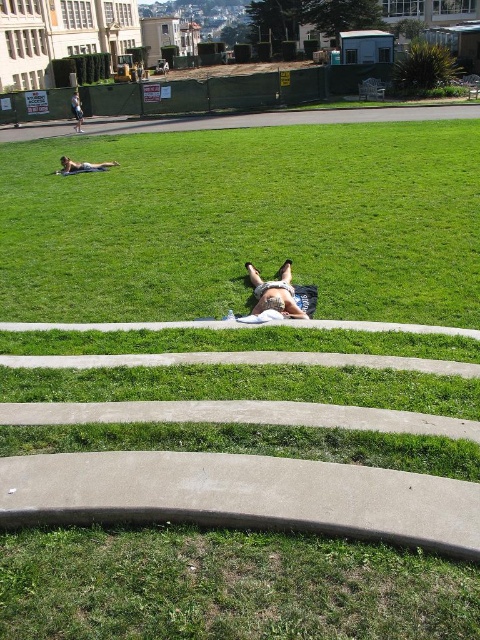
Question: Is white cotton towel at center to the left of light brown skin at upper left from the viewer's perspective?

Choices:
 (A) no
 (B) yes

Answer: (A)

Question: Which object is the farthest from the white cotton towel at center?

Choices:
 (A) green grass at center
 (B) light brown skin at upper left

Answer: (B)

Question: Is green grass at center behind light brown skin at upper left?

Choices:
 (A) no
 (B) yes

Answer: (A)

Question: Estimate the real-world distances between objects in this image. Which object is farther from the green grass at center?

Choices:
 (A) light brown skin at upper left
 (B) white cotton towel at center

Answer: (A)

Question: From the image, what is the correct spatial relationship of green grass at center in relation to white cotton towel at center?

Choices:
 (A) right
 (B) left

Answer: (B)

Question: Which object is the closest to the white cotton towel at center?

Choices:
 (A) green grass at center
 (B) light brown skin at upper left

Answer: (A)